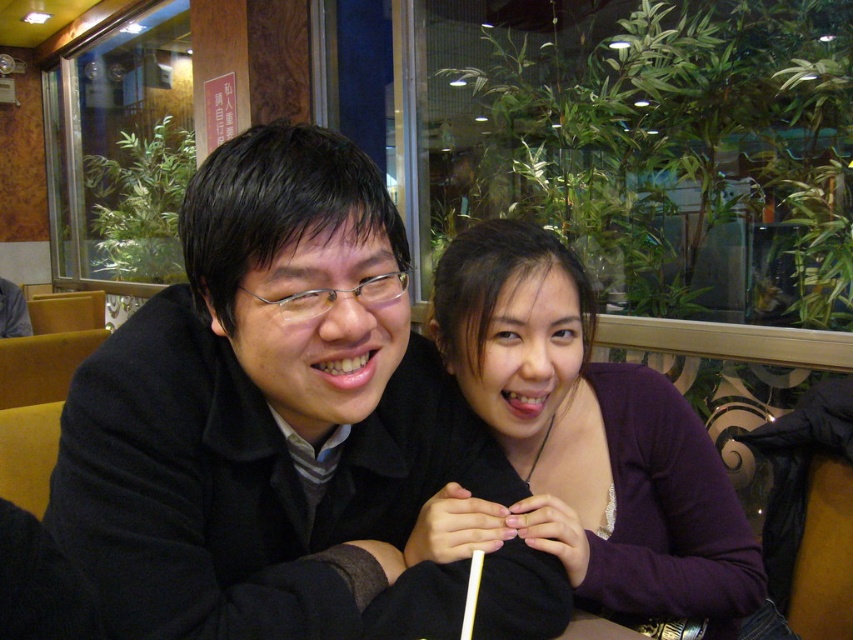
Question: Which point is farther from the camera taking this photo?

Choices:
 (A) (520, 611)
 (B) (440, 292)

Answer: (B)

Question: Can you confirm if black matte jacket at center is positioned to the left of purple matte sweater at center?

Choices:
 (A) no
 (B) yes

Answer: (B)

Question: Can you confirm if black matte jacket at center is positioned to the left of purple matte sweater at center?

Choices:
 (A) no
 (B) yes

Answer: (B)

Question: In this image, where is black matte jacket at center located relative to purple matte sweater at center?

Choices:
 (A) right
 (B) left

Answer: (B)

Question: Which object appears closest to the camera in this image?

Choices:
 (A) black matte jacket at center
 (B) purple matte sweater at center

Answer: (A)